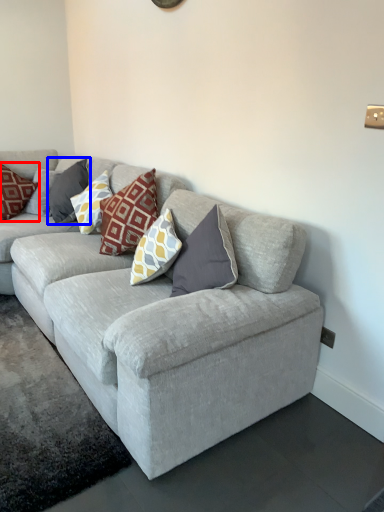
Question: Which point is closer to the camera, pillow (highlighted by a red box) or pillow (highlighted by a blue box)?

Choices:
 (A) pillow
 (B) pillow

Answer: (B)